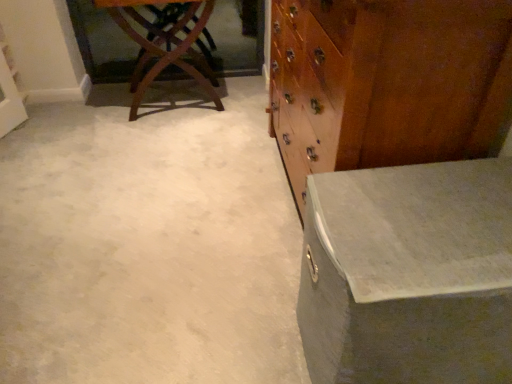
Question: Is white concrete at center to the left or to the right of wooden chest of drawers at right in the image?

Choices:
 (A) left
 (B) right

Answer: (A)

Question: From a real-world perspective, is white concrete at center positioned above or below wooden chest of drawers at right?

Choices:
 (A) below
 (B) above

Answer: (A)

Question: Considering the real-world distances, which object is closest to the mahogany wood table at upper left, which appears as the second table when viewed from the front?

Choices:
 (A) matte gray trunk at right, which appears as the second table when viewed from the left
 (B) wooden chest of drawers at right
 (C) white concrete at center

Answer: (C)

Question: Which object is the farthest from the matte gray trunk at right, arranged as the first table when ordered from the bottom?

Choices:
 (A) mahogany wood table at upper left, which appears as the first table when viewed from the back
 (B) white concrete at center
 (C) wooden chest of drawers at right

Answer: (A)